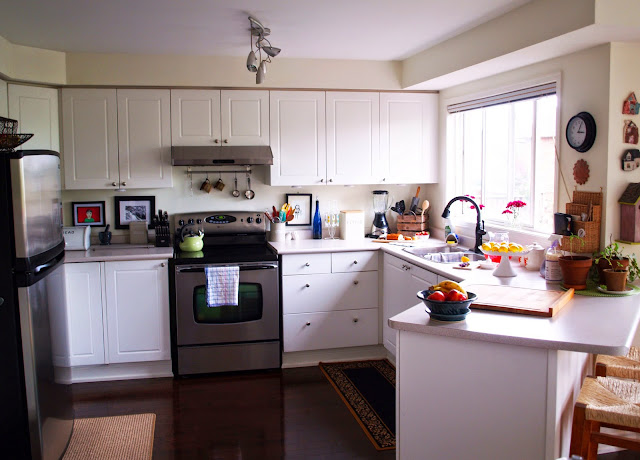
Locate an element on the screen. This screenshot has height=460, width=640. window is located at coordinates (506, 143).